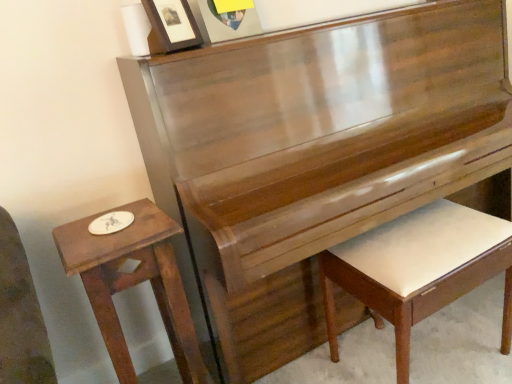
The height and width of the screenshot is (384, 512). What do you see at coordinates (224, 22) in the screenshot?
I see `matte wooden picture frame at upper center, placed as the first picture frame when sorted from right to left` at bounding box center [224, 22].

How much space does matte black picture frame at upper center, arranged as the 1th picture frame when viewed from the left, occupy vertically?

The height of matte black picture frame at upper center, arranged as the 1th picture frame when viewed from the left, is 6.95 inches.

Where is `wooden table at left`? This screenshot has height=384, width=512. wooden table at left is located at coordinates (133, 282).

The height and width of the screenshot is (384, 512). What do you see at coordinates (133, 282) in the screenshot?
I see `wooden table at left` at bounding box center [133, 282].

Find the location of a particular element. This screenshot has width=512, height=384. matte wooden picture frame at upper center, placed as the first picture frame when sorted from right to left is located at coordinates (224, 22).

Is white leather piano bench at lower right completely or partially outside of matte wooden picture frame at upper center, the second picture frame viewed from the left?

white leather piano bench at lower right is positioned outside matte wooden picture frame at upper center, the second picture frame viewed from the left.

Does white leather piano bench at lower right touch matte wooden picture frame at upper center, placed as the first picture frame when sorted from right to left?

white leather piano bench at lower right and matte wooden picture frame at upper center, placed as the first picture frame when sorted from right to left, are not in contact.

At what (x,y) coordinates should I click in order to perform the action: click on furniture that appears below the matte wooden picture frame at upper center, placed as the first picture frame when sorted from right to left (from a real-world perspective). Please return your answer as a coordinate pair (x, y). The height and width of the screenshot is (384, 512). Looking at the image, I should click on (419, 269).

Does white leather piano bench at lower right come behind matte wooden picture frame at upper center, the second picture frame viewed from the left?

No.

From the image's perspective, which is above, wooden table at left or white leather piano bench at lower right?

white leather piano bench at lower right appears higher in the image.

Which point is more distant from viewer, [124,236] or [426,233]?

The point [426,233] is more distant.

Between wooden table at left and white leather piano bench at lower right, which one has less height?

With less height is white leather piano bench at lower right.

Is wooden table at left to the right of white leather piano bench at lower right from the viewer's perspective?

Incorrect, wooden table at left is not on the right side of white leather piano bench at lower right.

Can you confirm if matte wooden picture frame at upper center, the second picture frame viewed from the left, is taller than wooden table at left?

No, matte wooden picture frame at upper center, the second picture frame viewed from the left, is not taller than wooden table at left.

This screenshot has height=384, width=512. I want to click on table that is in front of the matte wooden picture frame at upper center, the second picture frame viewed from the left, so (133, 282).

Consider the image. From a real-world perspective, is matte wooden picture frame at upper center, placed as the first picture frame when sorted from right to left, on wooden table at left?

Yes, from a real-world perspective, matte wooden picture frame at upper center, placed as the first picture frame when sorted from right to left, is above wooden table at left.

Is white leather piano bench at lower right positioned with its back to matte black picture frame at upper center, placed as the second picture frame when sorted from right to left?

No, white leather piano bench at lower right is not facing the opposite direction of matte black picture frame at upper center, placed as the second picture frame when sorted from right to left.

Are white leather piano bench at lower right and matte black picture frame at upper center, placed as the second picture frame when sorted from right to left, far apart?

No.

From the image's perspective, is white leather piano bench at lower right on matte black picture frame at upper center, arranged as the 1th picture frame when viewed from the left?

No, from the image's perspective, white leather piano bench at lower right is not above matte black picture frame at upper center, arranged as the 1th picture frame when viewed from the left.

Does white leather piano bench at lower right have a lesser width compared to matte black picture frame at upper center, placed as the second picture frame when sorted from right to left?

Incorrect, the width of white leather piano bench at lower right is not less than that of matte black picture frame at upper center, placed as the second picture frame when sorted from right to left.

In the scene shown: From the image's perspective, is matte wooden picture frame at upper center, placed as the first picture frame when sorted from right to left, above or below white leather piano bench at lower right?

Clearly, from the image's perspective, matte wooden picture frame at upper center, placed as the first picture frame when sorted from right to left, is above white leather piano bench at lower right.

Is matte wooden picture frame at upper center, placed as the first picture frame when sorted from right to left, next to white leather piano bench at lower right?

No, matte wooden picture frame at upper center, placed as the first picture frame when sorted from right to left, is not with white leather piano bench at lower right.

Is the depth of matte wooden picture frame at upper center, placed as the first picture frame when sorted from right to left, greater than that of white leather piano bench at lower right?

Yes, it is.

You are a GUI agent. You are given a task and a screenshot of the screen. Output one action in this format:
    pyautogui.click(x=<x>, y=<y>)
    Task: Click on the furniture in front of the matte wooden picture frame at upper center, placed as the first picture frame when sorted from right to left
    This screenshot has height=384, width=512.
    Given the screenshot: What is the action you would take?
    pos(419,269)

Which is correct: wooden table at left is inside matte black picture frame at upper center, arranged as the 1th picture frame when viewed from the left, or outside of it?

The correct answer is: outside.

Where is `the 1st picture frame counting from the right of the wooden table at left`? the 1st picture frame counting from the right of the wooden table at left is located at coordinates (170, 26).

Consider the image. From a real-world perspective, is wooden table at left positioned over matte black picture frame at upper center, placed as the second picture frame when sorted from right to left, based on gravity?

Incorrect, from a real-world perspective, wooden table at left is lower than matte black picture frame at upper center, placed as the second picture frame when sorted from right to left.

How different are the orientations of wooden table at left and matte black picture frame at upper center, placed as the second picture frame when sorted from right to left, in degrees?

They differ by 20.5 degrees in their facing directions.

Is matte wooden picture frame at upper center, placed as the first picture frame when sorted from right to left, with matte black picture frame at upper center, arranged as the 1th picture frame when viewed from the left?

matte wooden picture frame at upper center, placed as the first picture frame when sorted from right to left, and matte black picture frame at upper center, arranged as the 1th picture frame when viewed from the left, are not in contact.

Is matte wooden picture frame at upper center, the second picture frame viewed from the left, shorter than matte black picture frame at upper center, placed as the second picture frame when sorted from right to left?

Incorrect, the height of matte wooden picture frame at upper center, the second picture frame viewed from the left, does not fall short of that of matte black picture frame at upper center, placed as the second picture frame when sorted from right to left.

Between matte wooden picture frame at upper center, the second picture frame viewed from the left, and matte black picture frame at upper center, placed as the second picture frame when sorted from right to left, which one has smaller width?

matte wooden picture frame at upper center, the second picture frame viewed from the left, is thinner.

Is point (209, 33) closer to camera compared to point (186, 30)?

No, it is not.

At what (x,y) coordinates should I click in order to perform the action: click on the 2nd picture frame above the white leather piano bench at lower right (from the image's perspective). Please return your answer as a coordinate pair (x, y). This screenshot has height=384, width=512. Looking at the image, I should click on (224, 22).

Where is `table lying below the white leather piano bench at lower right (from the image's perspective)`? Image resolution: width=512 pixels, height=384 pixels. table lying below the white leather piano bench at lower right (from the image's perspective) is located at coordinates (133, 282).

Which object lies further to the anchor point matte wooden picture frame at upper center, placed as the first picture frame when sorted from right to left, white leather piano bench at lower right or matte black picture frame at upper center, placed as the second picture frame when sorted from right to left?

white leather piano bench at lower right is positioned further to the anchor matte wooden picture frame at upper center, placed as the first picture frame when sorted from right to left.

Based on their spatial positions, is wooden table at left or matte wooden picture frame at upper center, the second picture frame viewed from the left, closer to matte black picture frame at upper center, placed as the second picture frame when sorted from right to left?

Among the two, matte wooden picture frame at upper center, the second picture frame viewed from the left, is located nearer to matte black picture frame at upper center, placed as the second picture frame when sorted from right to left.

Based on their spatial positions, is matte wooden picture frame at upper center, placed as the first picture frame when sorted from right to left, or white leather piano bench at lower right closer to wooden table at left?

Based on the image, white leather piano bench at lower right appears to be nearer to wooden table at left.

Which object lies further to the anchor point white leather piano bench at lower right, matte black picture frame at upper center, placed as the second picture frame when sorted from right to left, or wooden table at left?

Based on the image, matte black picture frame at upper center, placed as the second picture frame when sorted from right to left, appears to be further to white leather piano bench at lower right.

Based on their spatial positions, is white leather piano bench at lower right or matte wooden picture frame at upper center, the second picture frame viewed from the left, further from matte black picture frame at upper center, placed as the second picture frame when sorted from right to left?

white leather piano bench at lower right lies further to matte black picture frame at upper center, placed as the second picture frame when sorted from right to left, than the other object.

Estimate the real-world distances between objects in this image. Which object is further from wooden table at left, matte black picture frame at upper center, arranged as the 1th picture frame when viewed from the left, or matte wooden picture frame at upper center, the second picture frame viewed from the left?

matte wooden picture frame at upper center, the second picture frame viewed from the left, is positioned further to the anchor wooden table at left.

Based on the photo, which object lies further to the anchor point wooden table at left, matte wooden picture frame at upper center, the second picture frame viewed from the left, or matte black picture frame at upper center, placed as the second picture frame when sorted from right to left?

Among the two, matte wooden picture frame at upper center, the second picture frame viewed from the left, is located further to wooden table at left.

Which object lies further to the anchor point matte wooden picture frame at upper center, the second picture frame viewed from the left, white leather piano bench at lower right or wooden table at left?

Based on the image, white leather piano bench at lower right appears to be further to matte wooden picture frame at upper center, the second picture frame viewed from the left.

Find the location of a particular element. The image size is (512, 384). furniture between matte black picture frame at upper center, arranged as the 1th picture frame when viewed from the left, and wooden table at left from top to bottom is located at coordinates (419, 269).

The height and width of the screenshot is (384, 512). What are the coordinates of `picture frame between matte wooden picture frame at upper center, the second picture frame viewed from the left, and white leather piano bench at lower right from top to bottom` in the screenshot? It's located at (170, 26).

Identify the location of picture frame between matte wooden picture frame at upper center, placed as the first picture frame when sorted from right to left, and wooden table at left in the up-down direction. The image size is (512, 384). (170, 26).

The height and width of the screenshot is (384, 512). I want to click on furniture that lies between matte wooden picture frame at upper center, placed as the first picture frame when sorted from right to left, and wooden table at left from top to bottom, so click(x=419, y=269).